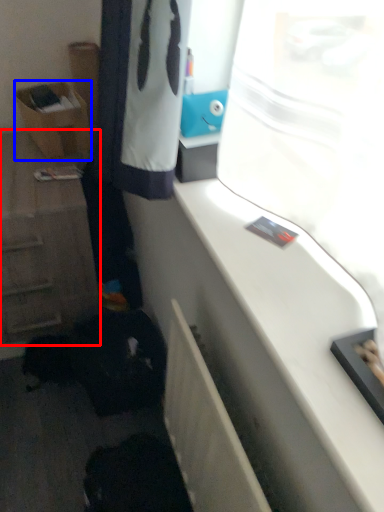
Question: Which of the following is the closest to the observer, cabinetry (highlighted by a red box) or shelf (highlighted by a blue box)?

Choices:
 (A) cabinetry
 (B) shelf

Answer: (A)